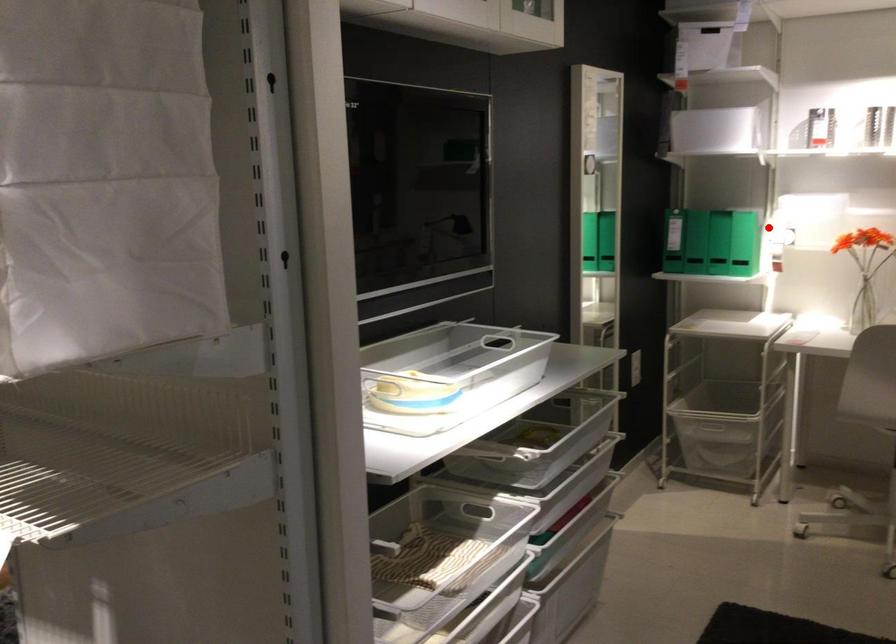
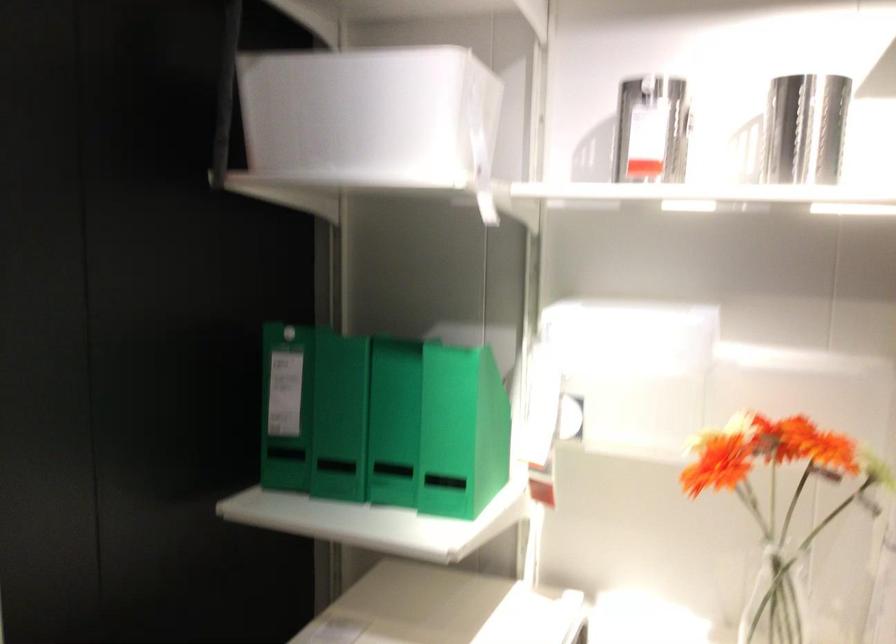
In the second image, find the point that corresponds to the highlighted location in the first image.

(461, 431)